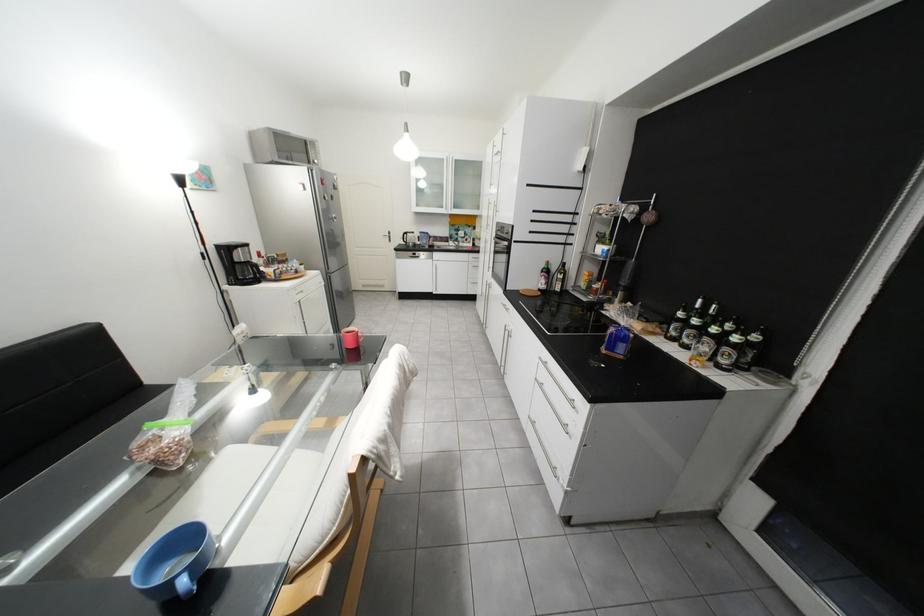
Find where to sit the sofa sitting surface. Please return your answer as a coordinate pair (x, y).

(71, 440)